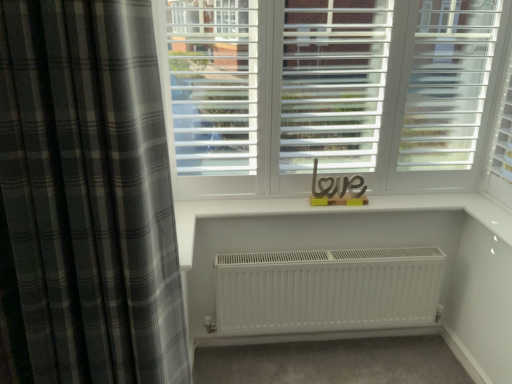
What do you see at coordinates (87, 196) in the screenshot? I see `gray plaid curtain at left` at bounding box center [87, 196].

The width and height of the screenshot is (512, 384). Find the location of `gray plaid curtain at left`. gray plaid curtain at left is located at coordinates (87, 196).

Where is `gray plaid curtain at left`? This screenshot has width=512, height=384. gray plaid curtain at left is located at coordinates (87, 196).